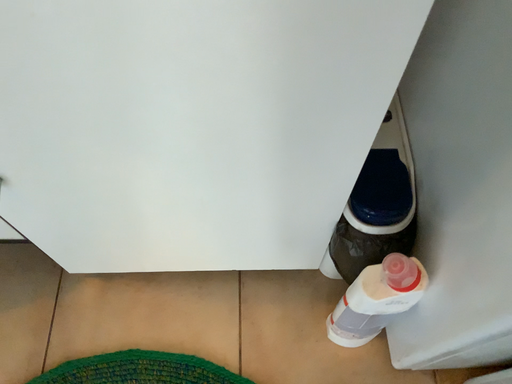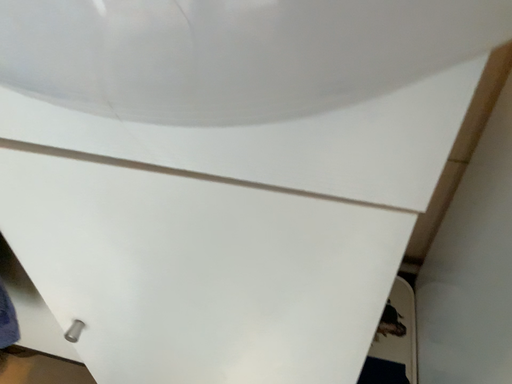
Question: Which way did the camera rotate in the video?

Choices:
 (A) rotated right
 (B) rotated left

Answer: (B)